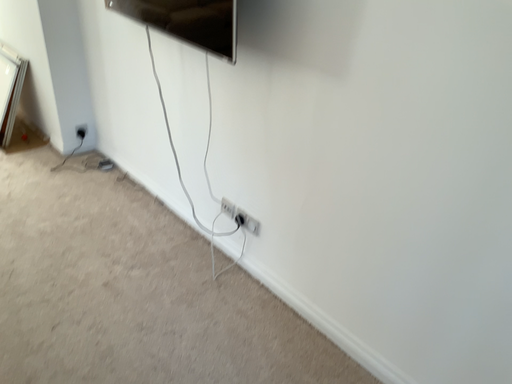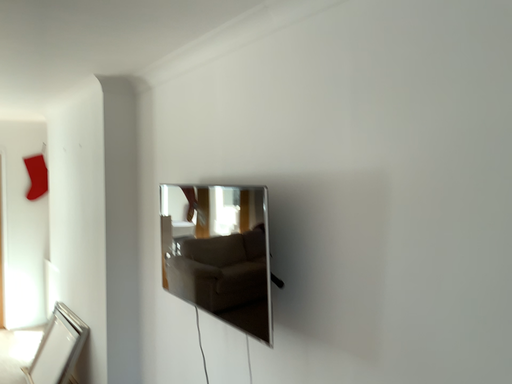
Question: How did the camera likely rotate when shooting the video?

Choices:
 (A) rotated left
 (B) rotated right

Answer: (A)